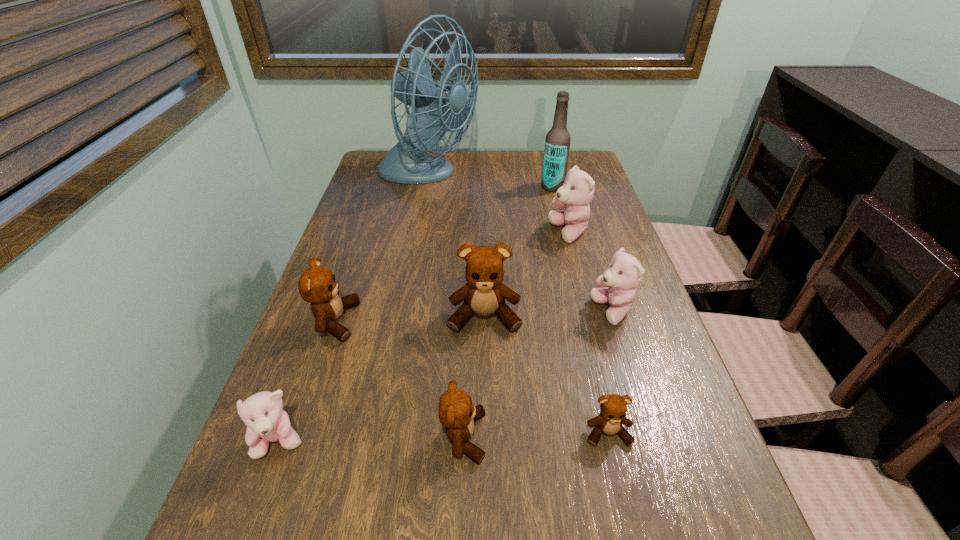
Identify the location of object that is at the far left corner. (435, 107).

At what (x,y) coordinates should I click in order to perform the action: click on object positioned at the far right corner. Please return your answer as a coordinate pair (x, y). Looking at the image, I should click on (x=557, y=143).

In the image, there is a desktop. Where is `vacant space at the left edge`? The width and height of the screenshot is (960, 540). vacant space at the left edge is located at coordinates [341, 255].

Image resolution: width=960 pixels, height=540 pixels. Find the location of `free space at the right edge`. free space at the right edge is located at coordinates (642, 481).

The image size is (960, 540). In order to click on free spot at the far right corner of the desktop in this screenshot , I will do `click(575, 153)`.

The width and height of the screenshot is (960, 540). What are the coordinates of `vacant region between the second nearest pink teddy bear and the fan` in the screenshot? It's located at click(520, 244).

The height and width of the screenshot is (540, 960). What are the coordinates of `free area in between the third biggest brown teddy bear and the farthest pink teddy bear` in the screenshot? It's located at (516, 335).

Identify the location of vacant space that is in between the leftmost pink teddy bear and the second smallest pink teddy bear. This screenshot has width=960, height=540. (446, 377).

What are the coordinates of `free point between the second smallest brown teddy bear and the fan` in the screenshot? It's located at (445, 307).

Locate an element on the screen. The height and width of the screenshot is (540, 960). unoccupied area between the fan and the smallest pink teddy bear is located at coordinates (354, 309).